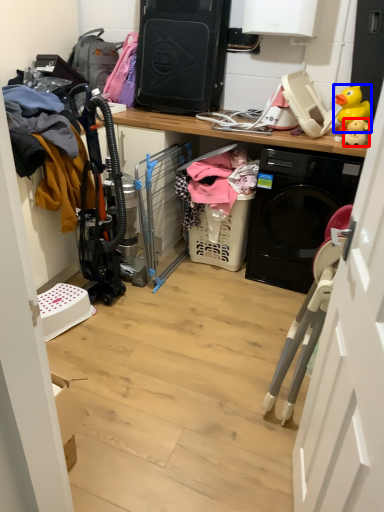
Question: Among these objects, which one is nearest to the camera, toy (highlighted by a red box) or toy (highlighted by a blue box)?

Choices:
 (A) toy
 (B) toy

Answer: (A)